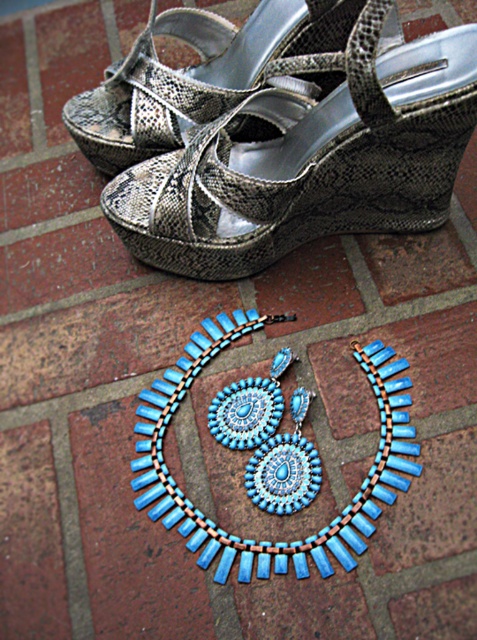
You are a photographer setting up a shot of the turquoise beaded necklace at center. If your camera can focus on objects within 3 feet, will it be able to capture the necklace clearly?

The turquoise beaded necklace at center is 3.63 feet away from the camera, which is beyond the 3 feet focus range. Therefore, the camera might not capture it clearly unless adjusted.

You are a customer trying to decide whether to buy the snake skin silver sandal at upper center and the turquoise beaded necklace at center. You want to know if the sandal is placed in front of the necklace in the image. Can you confirm this?

Yes, the snake skin silver sandal at upper center is in front of the turquoise beaded necklace at center in the image.

You are a customer at a boutique store trying to decide between the snake skin silver sandal at upper center and the shiny metallic sandal at upper center. The salesperson mentions that one is positioned higher than the other. Which sandal should you point to if you want the one placed higher?

The shiny metallic sandal at upper center is positioned higher than the snake skin silver sandal at upper center, so you should point to the shiny metallic sandal at upper center.